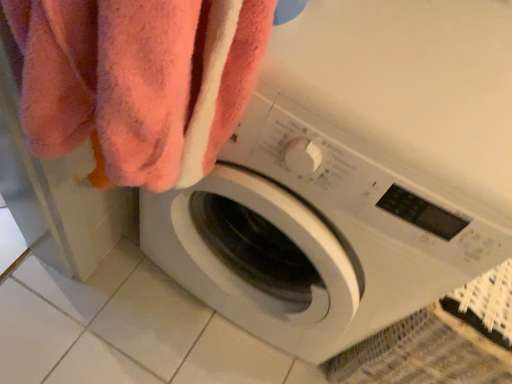
Question: From a real-world perspective, is soft pink towel at upper left above or below white plastic washing machine at center?

Choices:
 (A) below
 (B) above

Answer: (B)

Question: In terms of width, does soft pink towel at upper left look wider or thinner when compared to white plastic washing machine at center?

Choices:
 (A) wide
 (B) thin

Answer: (B)

Question: From the image's perspective, relative to white plastic washing machine at center, is soft pink towel at upper left above or below?

Choices:
 (A) above
 (B) below

Answer: (B)

Question: Based on their sizes in the image, would you say white plastic washing machine at center is bigger or smaller than soft pink towel at upper left?

Choices:
 (A) small
 (B) big

Answer: (B)

Question: From a real-world perspective, is white plastic washing machine at center above or below soft pink towel at upper left?

Choices:
 (A) above
 (B) below

Answer: (B)

Question: In terms of height, does white plastic washing machine at center look taller or shorter compared to soft pink towel at upper left?

Choices:
 (A) tall
 (B) short

Answer: (A)

Question: Is white plastic washing machine at center inside or outside of soft pink towel at upper left?

Choices:
 (A) inside
 (B) outside

Answer: (B)